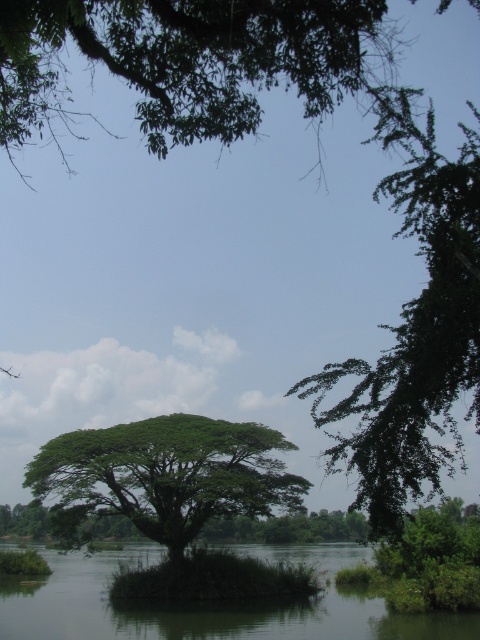
You are standing on the bank of the lake and see the green leafy tree at upper center and the green leafy tree at center. Which tree has a wider canopy?

The green leafy tree at upper center might be wider than the green leafy tree at center.

From the picture: You are standing at the edge of the water and see two points marked in the scene. Which point, point (136, 1) or point (0, 588), is closer to you?

Point (136, 1) is closer to the viewer than point (0, 588).